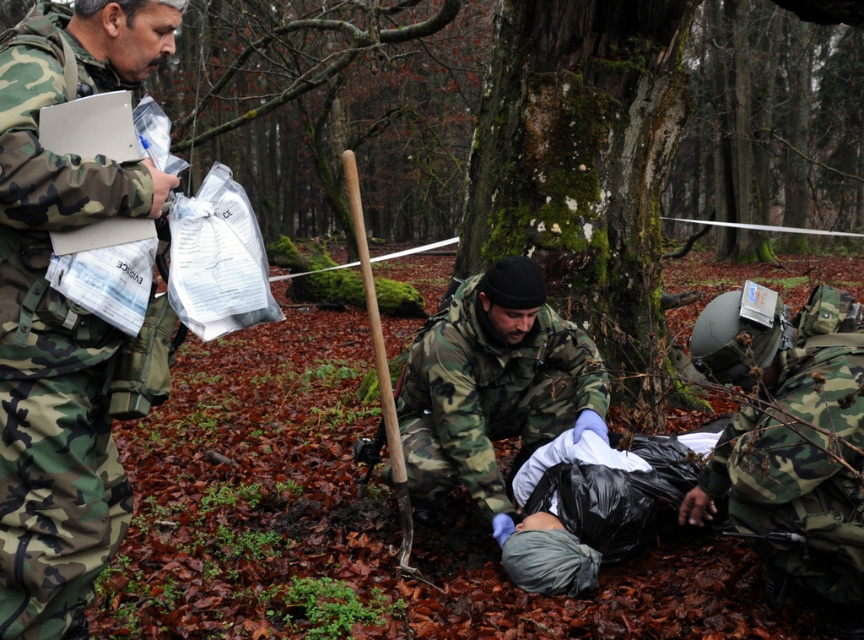
You are a member of the team in the forest. You need to move from your current position to the point marked at coordinates point (766, 545). However, there is an obstacle at point (383, 417). Can you safely navigate around the obstacle to reach your destination?

Since point (766, 545) is in front of point (383, 417), you can safely navigate around the obstacle by moving forward towards the destination without needing to go around the obstacle at point (383, 417).

You are a photographer trying to capture a group photo of the camouflage uniform at left and the camo uniform at lower right. Which person should you position closer to the camera to ensure they appear larger in the photo?

You should position the camo uniform at lower right closer to the camera because it occupies more space than the camouflage uniform at left, so moving it closer will make it appear even larger in the photo.